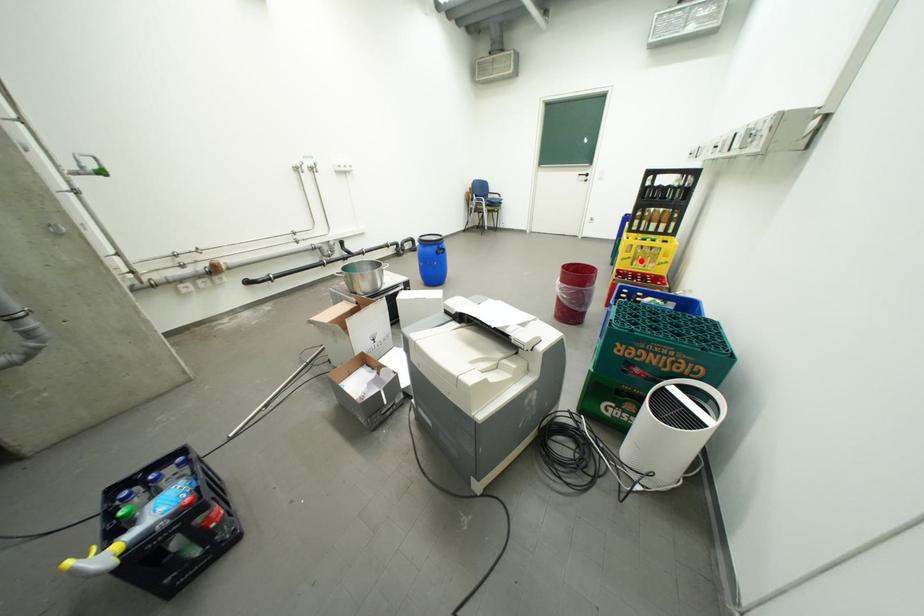
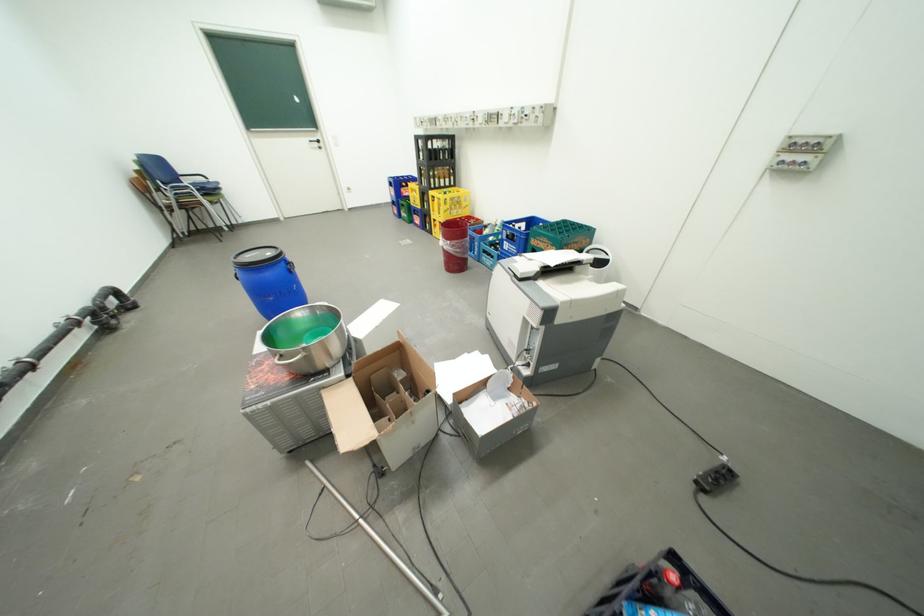
Question: I am providing you with two images of the same scene from different viewpoints. Given a red point in image1, look at the same physical point in image2. Is it:

Choices:
 (A) Closer to the viewpoint
 (B) Farther from the viewpoint

Answer: (B)